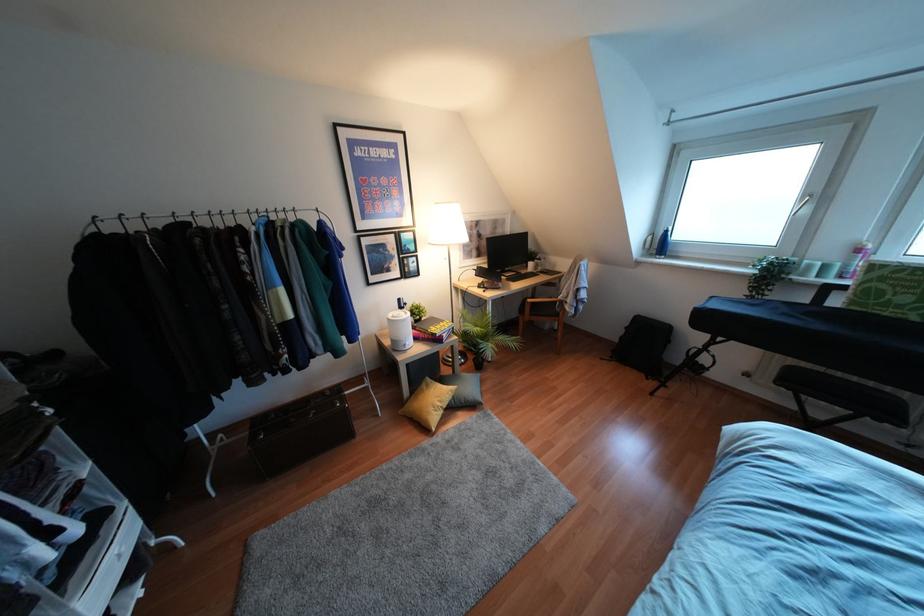
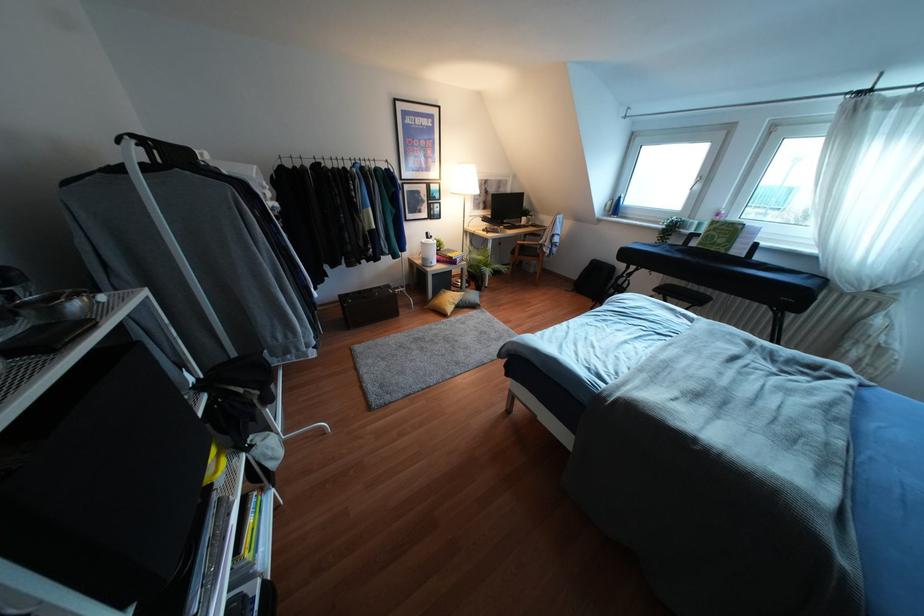
In the second image, find the point that corresponds to point (422, 385) in the first image.

(441, 292)